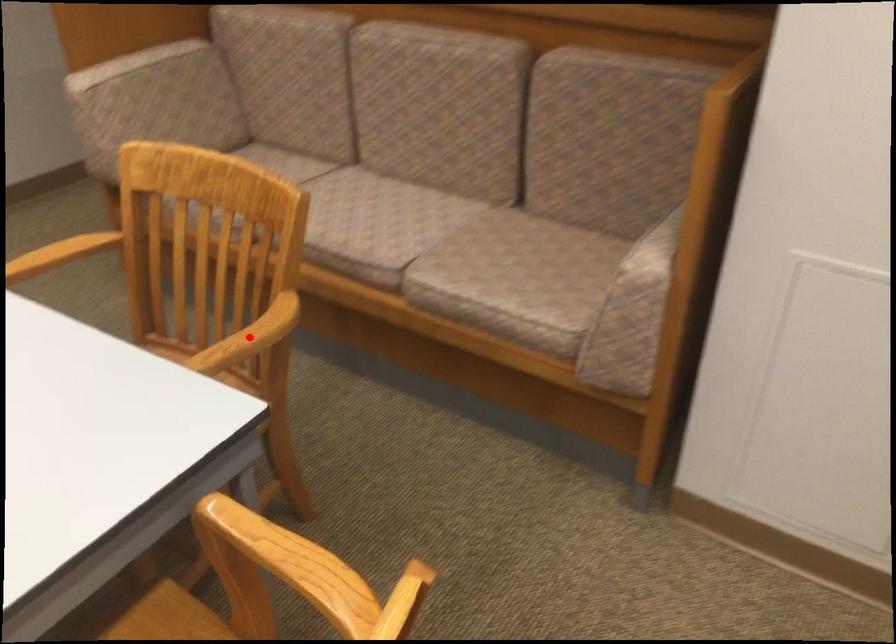
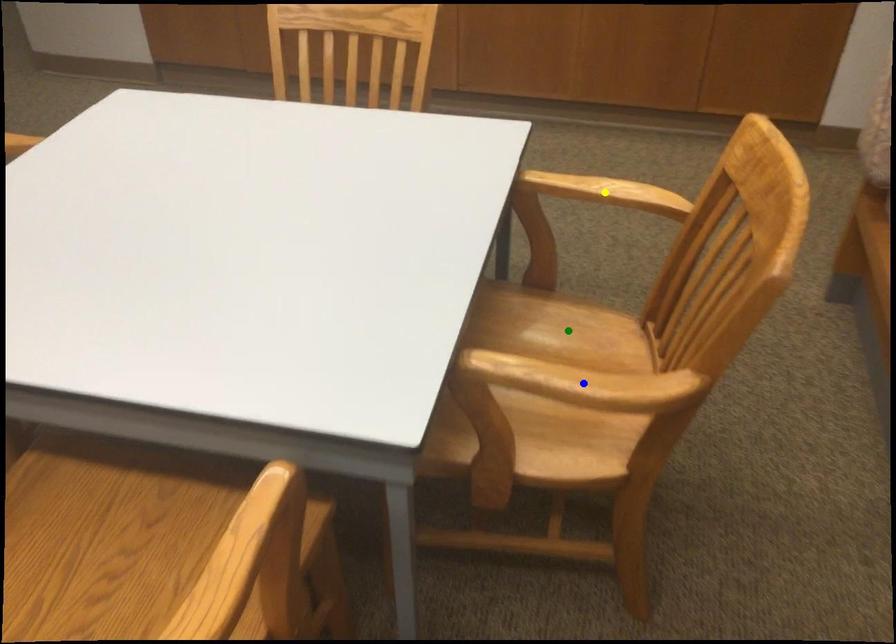
Question: I am providing you with two images of the same scene from different viewpoints. A red point is marked on the first image. You are given multiple points on the second image. Can you choose the point in image 2 that corresponds to the point in image 1?

Choices:
 (A) blue point
 (B) yellow point
 (C) green point

Answer: (A)